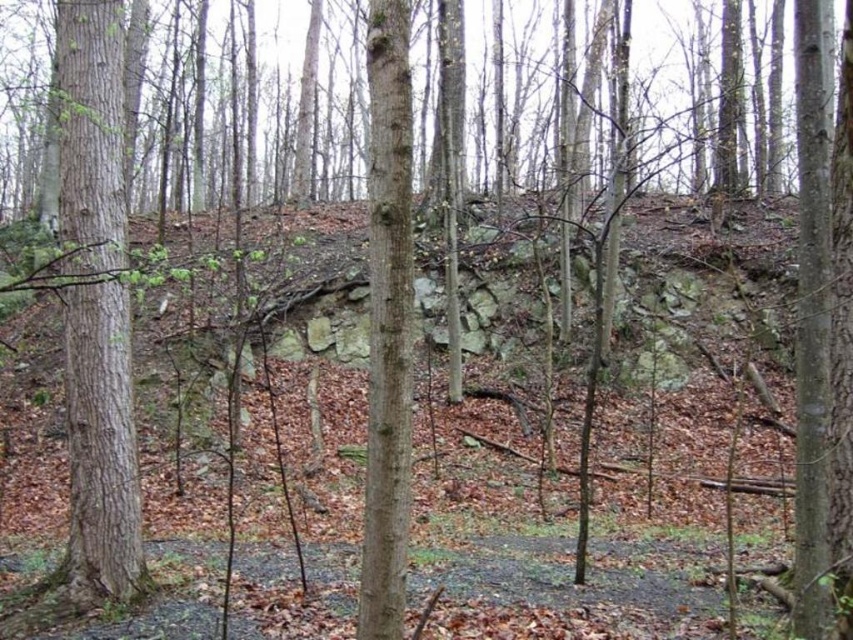
Which of these two, smooth brown tree trunk at left or smooth brown tree trunk at center, stands shorter?

smooth brown tree trunk at center is shorter.

Identify the location of smooth brown tree trunk at left. (102, 448).